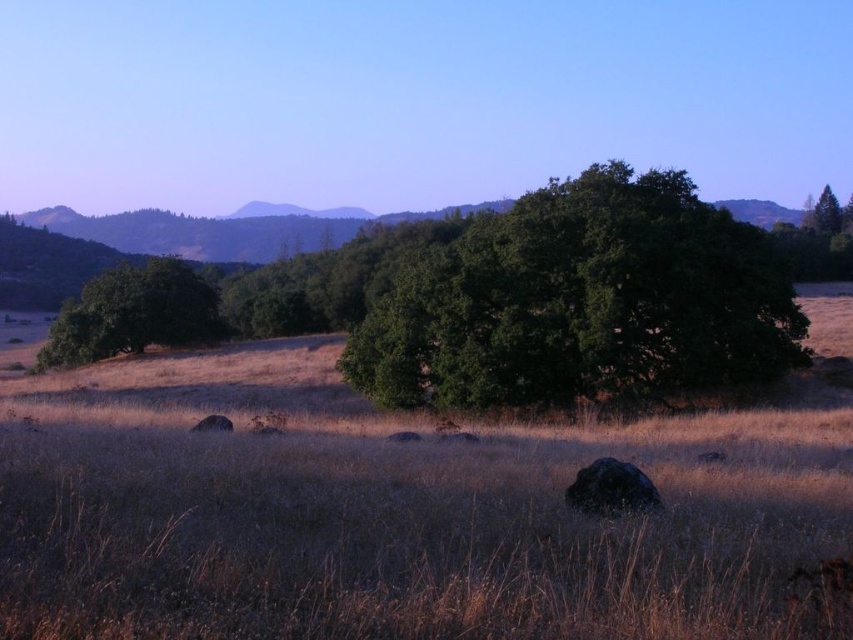
You are an environmental scientist studying tree growth patterns. You observe the green leafy tree at left and the green matte tree at upper right in the landscape. Which tree would you expect to have a smaller canopy spread based on their height?

The green leafy tree at left is shorter than the green matte tree at upper right, so it likely has a smaller canopy spread due to its shorter height.

You are an environmental scientist assessing the landscape. You notice the green leafy tree at center and the green matte tree at upper right. Which tree would you expect to have a smaller canopy area based on their sizes?

The green leafy tree at center has a smaller size compared to the green matte tree at upper right, so it would have a smaller canopy area.